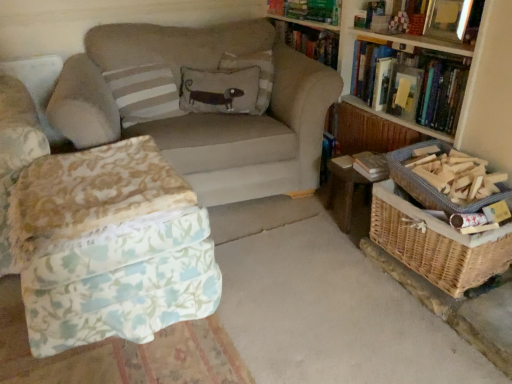
Locate an element on the screen. The image size is (512, 384). free space to the left of woven wood table at lower right is located at coordinates (293, 228).